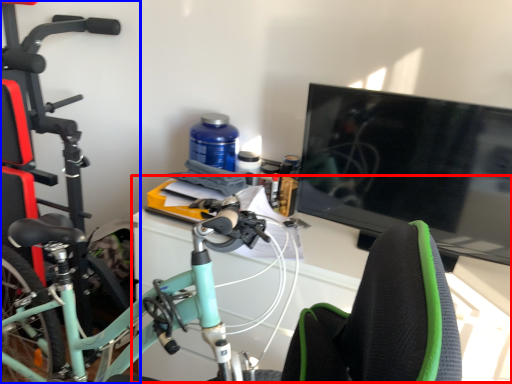
Question: Which of the following is the closest to the observer, computer desk (highlighted by a red box) or bicycle (highlighted by a blue box)?

Choices:
 (A) computer desk
 (B) bicycle

Answer: (A)